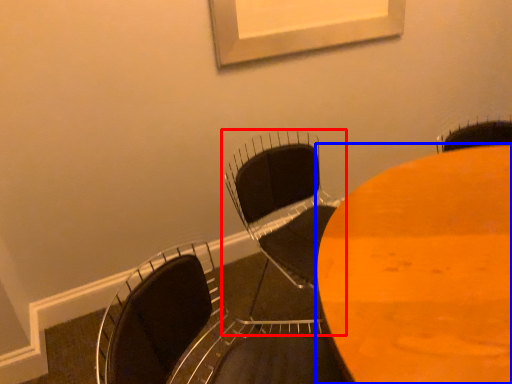
Question: Which of the following is the farthest to the observer, chair (highlighted by a red box) or table (highlighted by a blue box)?

Choices:
 (A) chair
 (B) table

Answer: (A)